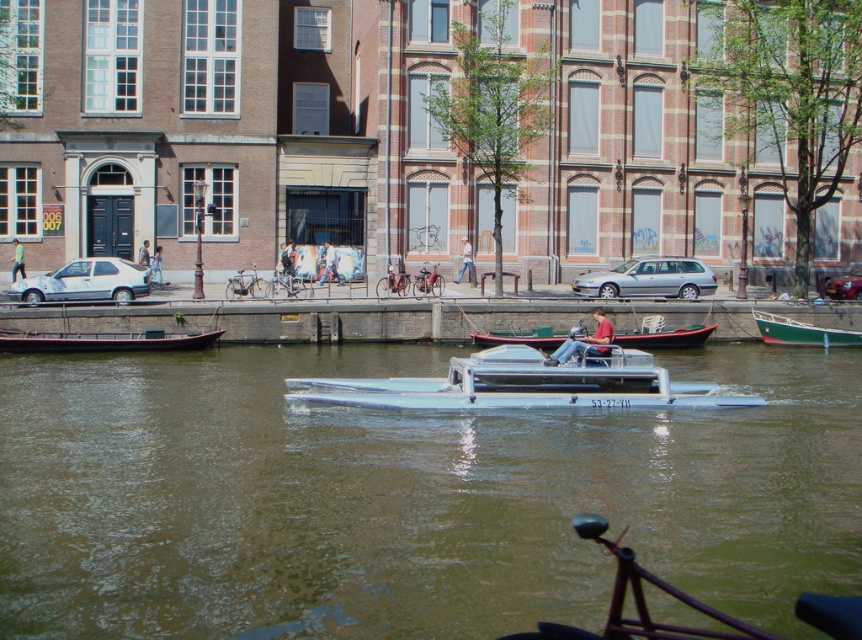
Does brown water at center appear over satin silver wagon at center?

Actually, brown water at center is below satin silver wagon at center.

Between point (294, 504) and point (692, 262), which one is positioned in front?

Point (294, 504) is in front.

Between point (315, 483) and point (586, 285), which one is positioned in front?

Point (315, 483)

At what (x,y) coordinates should I click in order to perform the action: click on brown water at center. Please return your answer as a coordinate pair (x, y). Image resolution: width=862 pixels, height=640 pixels. Looking at the image, I should click on (407, 497).

Is brown water at center closer to camera compared to wooden boat at center?

Yes, brown water at center is in front of wooden boat at center.

Is brown water at center to the right of wooden boat at center from the viewer's perspective?

No, brown water at center is not to the right of wooden boat at center.

Is point (67, 392) closer to viewer compared to point (647, 326)?

Yes, point (67, 392) is in front of point (647, 326).

I want to click on brown water at center, so click(x=407, y=497).

Does metallic silver boat at center have a greater height compared to satin silver wagon at center?

Indeed, metallic silver boat at center has a greater height compared to satin silver wagon at center.

Who is more forward, [330,381] or [598,282]?

Positioned in front is point [330,381].

In order to click on metallic silver boat at center in this screenshot , I will do `click(520, 385)`.